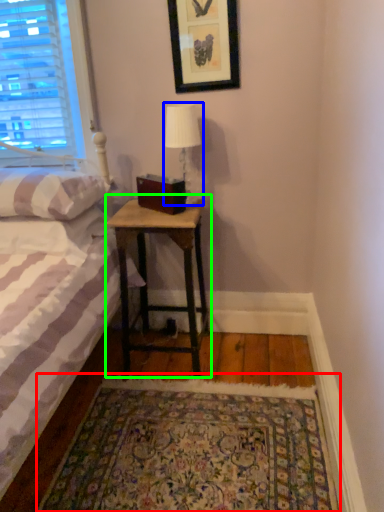
Question: Which object is positioned closest to mat (highlighted by a red box)? Select from table lamp (highlighted by a blue box) and nightstand (highlighted by a green box).

Choices:
 (A) table lamp
 (B) nightstand

Answer: (B)